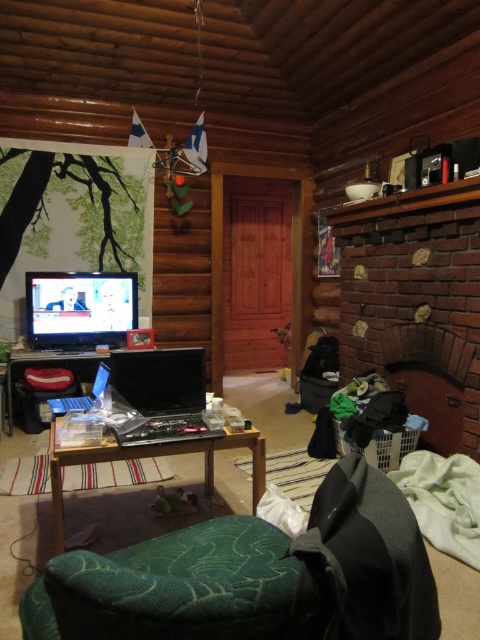
Which is more to the right, wooden table at center or shiny silver laptop at lower left?

Positioned to the right is wooden table at center.

Who is more forward, (240, 435) or (82, 401)?

Positioned in front is point (240, 435).

Between point (52, 532) and point (88, 396), which one is positioned in front?

Positioned in front is point (52, 532).

At what (x,y) coordinates should I click in order to perform the action: click on wooden table at center. Please return your answer as a coordinate pair (x, y). Looking at the image, I should click on (151, 456).

Can you confirm if brick fireplace at upper right is positioned to the right of satin black laptop at center?

Yes, brick fireplace at upper right is to the right of satin black laptop at center.

Locate an element on the screen. The image size is (480, 640). brick fireplace at upper right is located at coordinates (416, 301).

The width and height of the screenshot is (480, 640). I want to click on brick fireplace at upper right, so click(416, 301).

Is green fabric armchair at lower center bigger than wooden table at center?

Yes, green fabric armchair at lower center is bigger than wooden table at center.

Is point (87, 570) positioned before point (253, 428)?

That is True.

You are a GUI agent. You are given a task and a screenshot of the screen. Output one action in this format:
    pyautogui.click(x=<x>, y=<y>)
    Task: Click on the green fabric armchair at lower center
    This screenshot has height=640, width=480.
    Given the screenshot: What is the action you would take?
    pyautogui.click(x=253, y=577)